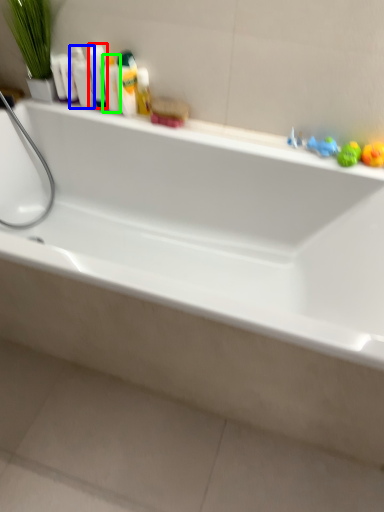
Question: Based on their relative distances, which object is nearer to toiletry (highlighted by a red box)? Choose from mouthwash (highlighted by a blue box) and mouthwash (highlighted by a green box).

Choices:
 (A) mouthwash
 (B) mouthwash

Answer: (B)